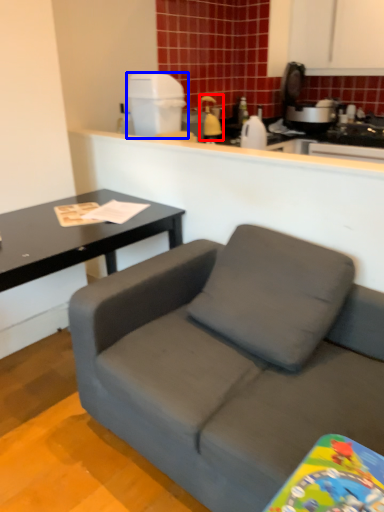
Question: Among these objects, which one is farthest to the camera, appliance (highlighted by a red box) or appliance (highlighted by a blue box)?

Choices:
 (A) appliance
 (B) appliance

Answer: (A)